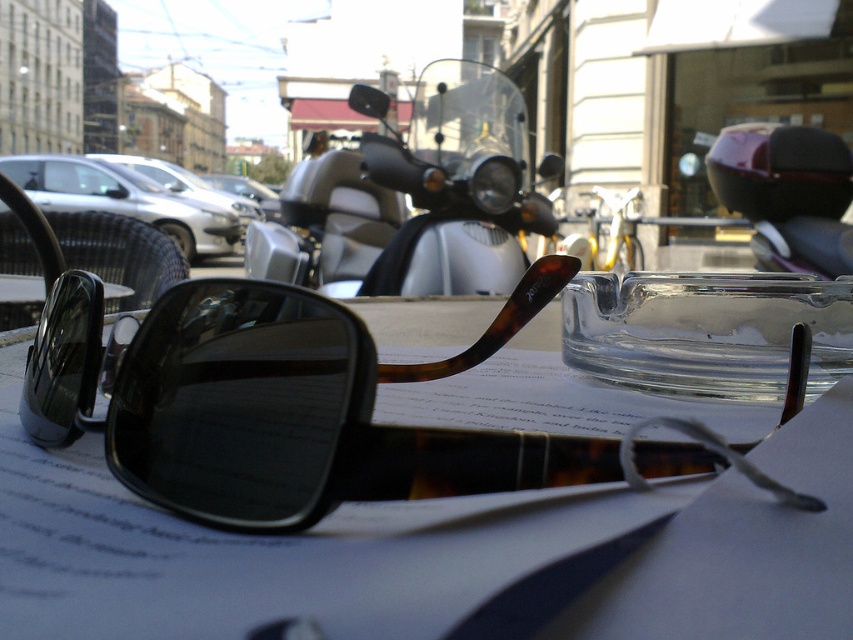
Who is higher up, metallic silver scooter at center or transparent glass ashtray at center?

metallic silver scooter at center is higher up.

Does point (467, 269) come in front of point (801, 316)?

No, (467, 269) is further to viewer.

The image size is (853, 640). In order to click on metallic silver scooter at center in this screenshot , I will do tap(457, 186).

Does metallic silver scooter at center have a lesser height compared to metallic silver motorcycle at center?

No, metallic silver scooter at center is not shorter than metallic silver motorcycle at center.

Does metallic silver scooter at center have a larger size compared to metallic silver motorcycle at center?

Correct, metallic silver scooter at center is larger in size than metallic silver motorcycle at center.

What do you see at coordinates (457, 186) in the screenshot? I see `metallic silver scooter at center` at bounding box center [457, 186].

Locate an element on the screen. metallic silver scooter at center is located at coordinates click(457, 186).

Does transparent glass ashtray at center have a lesser height compared to metallic silver motorcycle at center?

Indeed, transparent glass ashtray at center has a lesser height compared to metallic silver motorcycle at center.

Image resolution: width=853 pixels, height=640 pixels. What are the coordinates of `transparent glass ashtray at center` in the screenshot? It's located at (705, 332).